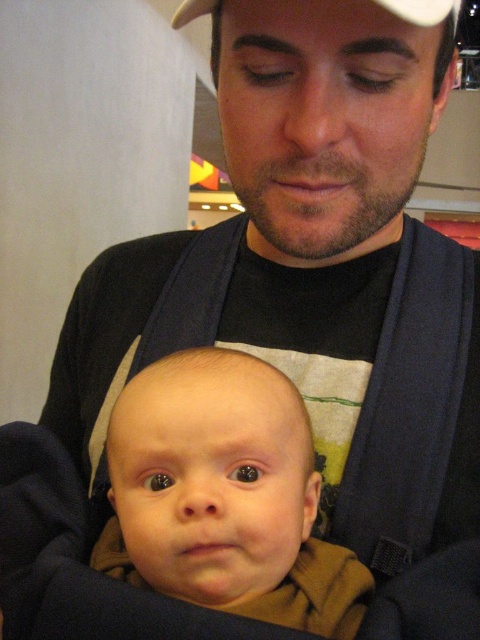
Which is more to the right, navy blue fabric strap at center or white matte baseball cap at upper center?

white matte baseball cap at upper center

Does navy blue fabric strap at center have a greater width compared to white matte baseball cap at upper center?

No.

Which is behind, point (171, 332) or point (205, 4)?

The point (171, 332) is more distant.

This screenshot has width=480, height=640. What are the coordinates of `navy blue fabric strap at center` in the screenshot? It's located at (191, 296).

Does point (274, 589) lie behind point (196, 237)?

No, (274, 589) is closer to viewer.

Which is below, brown soft fabric baby at center or navy blue fabric strap at center?

Positioned lower is brown soft fabric baby at center.

Does point (349, 605) lie in front of point (200, 342)?

Yes.

Find the location of a particular element. The width and height of the screenshot is (480, 640). brown soft fabric baby at center is located at coordinates (225, 496).

Which is more to the right, brown soft fabric baby at center or white matte baseball cap at upper center?

From the viewer's perspective, white matte baseball cap at upper center appears more on the right side.

Image resolution: width=480 pixels, height=640 pixels. What do you see at coordinates (225, 496) in the screenshot?
I see `brown soft fabric baby at center` at bounding box center [225, 496].

Which is behind, point (126, 541) or point (425, 8)?

Point (126, 541)

Identify the location of brown soft fabric baby at center. (225, 496).